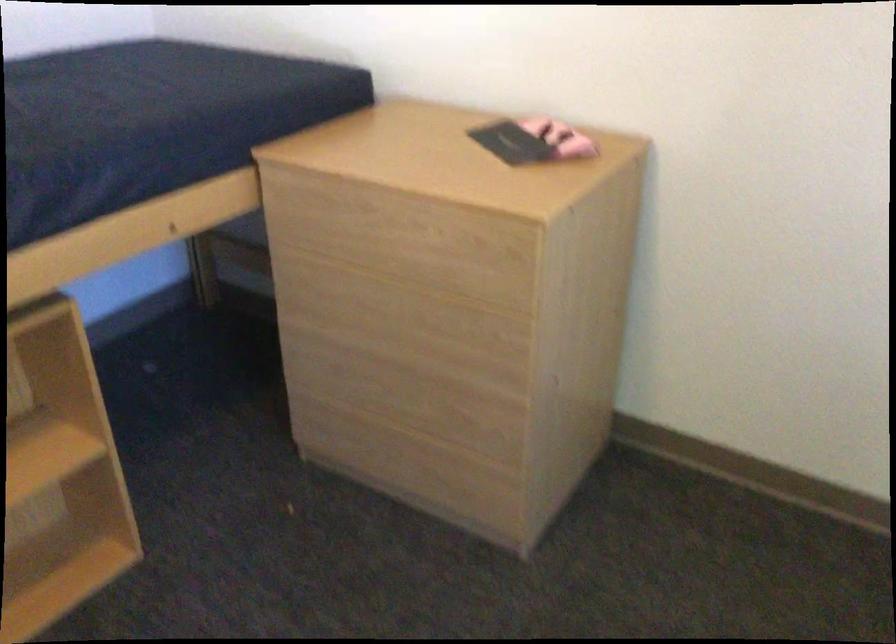
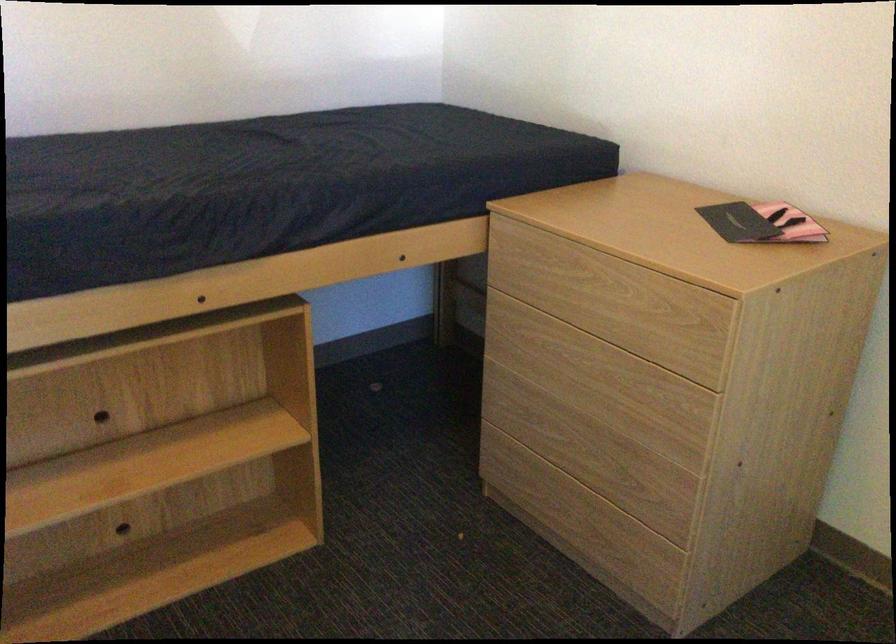
Locate, in the second image, the point that corresponds to pixel 383 231 in the first image.

(582, 287)